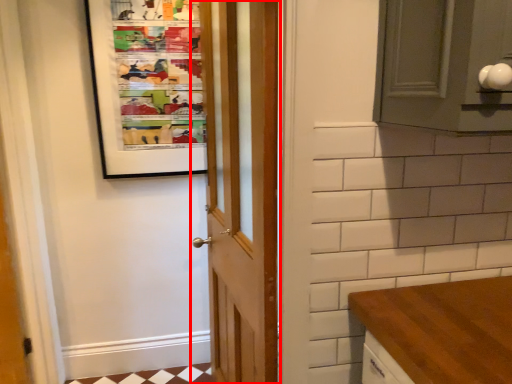
Question: Where is door (annotated by the red box) located in relation to bulletin board in the image?

Choices:
 (A) left
 (B) right

Answer: (B)